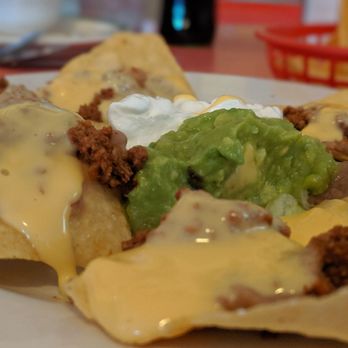
You are a GUI agent. You are given a task and a screenshot of the screen. Output one action in this format:
    pyautogui.click(x=<x>, y=<y>)
    Task: Click on the plate beneath nachos
    
    Given the screenshot: What is the action you would take?
    pyautogui.click(x=37, y=329)